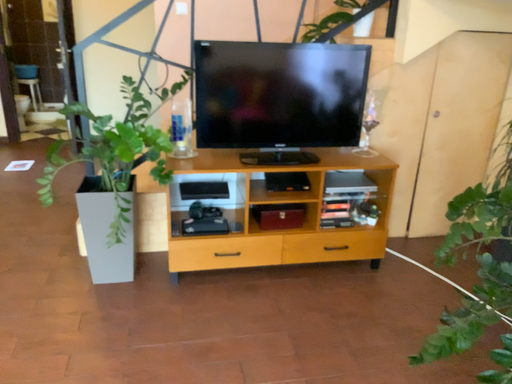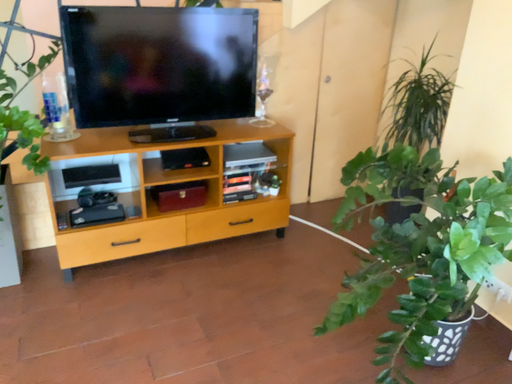
Question: Which way did the camera rotate in the video?

Choices:
 (A) rotated right
 (B) rotated left

Answer: (A)